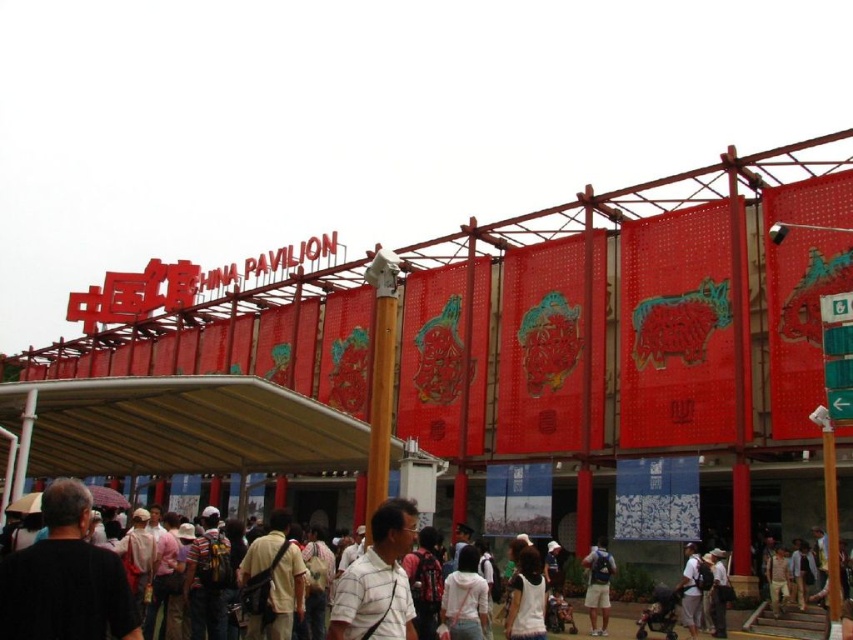
Question: Can you confirm if plaid shirt at center is smaller than matte black backpack at lower right?

Choices:
 (A) yes
 (B) no

Answer: (B)

Question: Is plaid shirt at center positioned in front of matte black backpack at lower right?

Choices:
 (A) yes
 (B) no

Answer: (A)

Question: Which point appears closest to the camera in this image?

Choices:
 (A) tap(589, 564)
 (B) tap(381, 534)

Answer: (B)

Question: Among these objects, which one is nearest to the camera?

Choices:
 (A) plaid shirt at center
 (B) matte black backpack at lower right

Answer: (A)

Question: From the image, what is the correct spatial relationship of plaid shirt at center in relation to matte black backpack at lower right?

Choices:
 (A) right
 (B) left

Answer: (B)